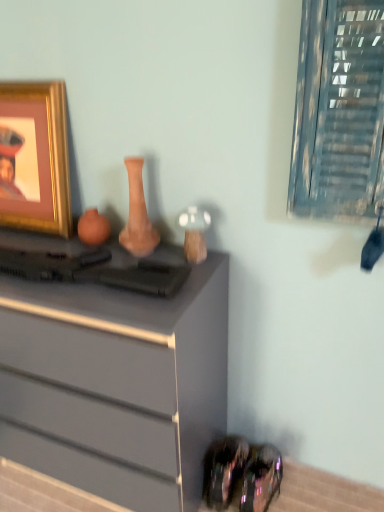
Question: From the image's perspective, is gold metallic picture frame at upper left above or below metallic glass window at upper right?

Choices:
 (A) above
 (B) below

Answer: (A)

Question: Is gold metallic picture frame at upper left wider or thinner than metallic glass window at upper right?

Choices:
 (A) wide
 (B) thin

Answer: (A)

Question: Which object is the closest to the shiny black shoe at lower right?

Choices:
 (A) gold metallic picture frame at upper left
 (B) matte clay vase at center
 (C) matte gray chest of drawers at center
 (D) metallic glass window at upper right

Answer: (C)

Question: Which object is positioned closest to the gold metallic picture frame at upper left?

Choices:
 (A) matte clay vase at center
 (B) shiny black shoe at lower right
 (C) matte gray chest of drawers at center
 (D) metallic glass window at upper right

Answer: (A)